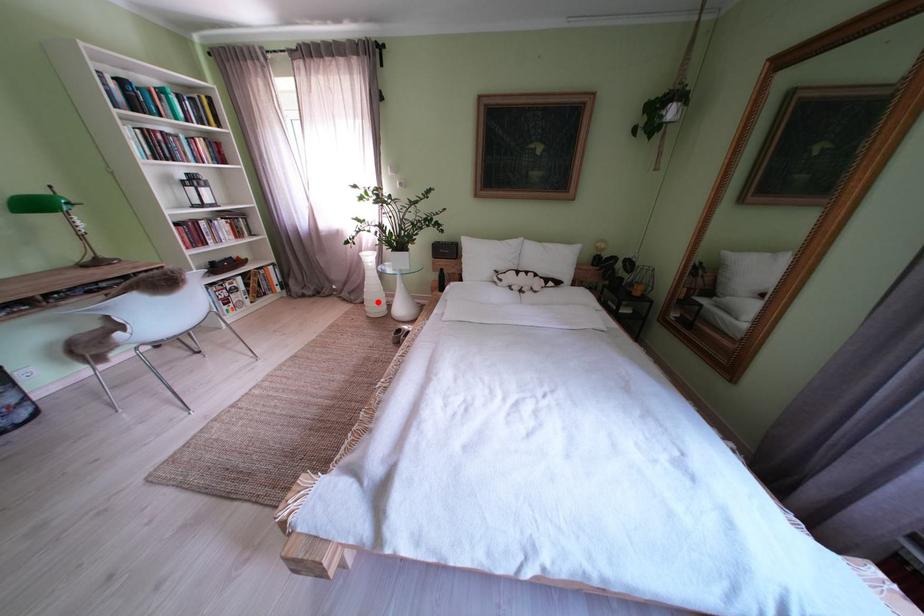
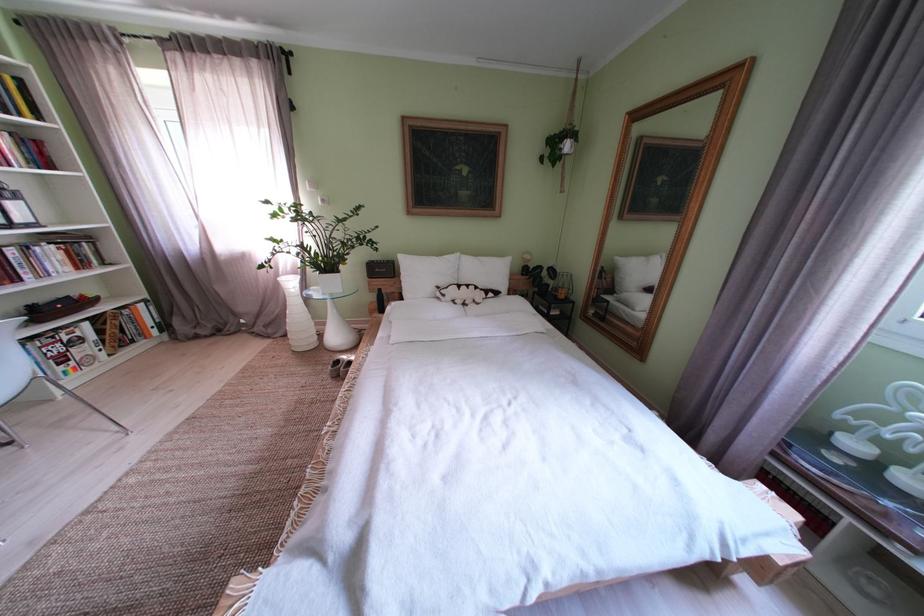
Find the pixel in the second image that matches the highlighted location in the first image.

(301, 334)